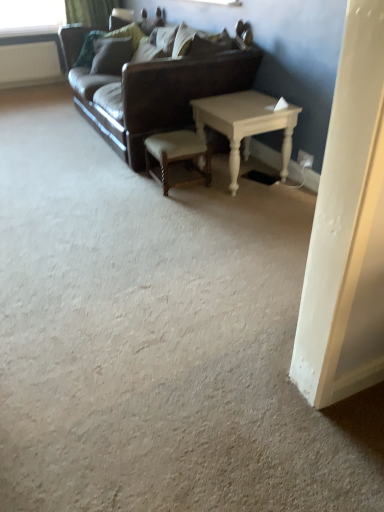
The height and width of the screenshot is (512, 384). In order to click on free spot to the left of wooden polished stool at center in this screenshot , I will do `click(128, 186)`.